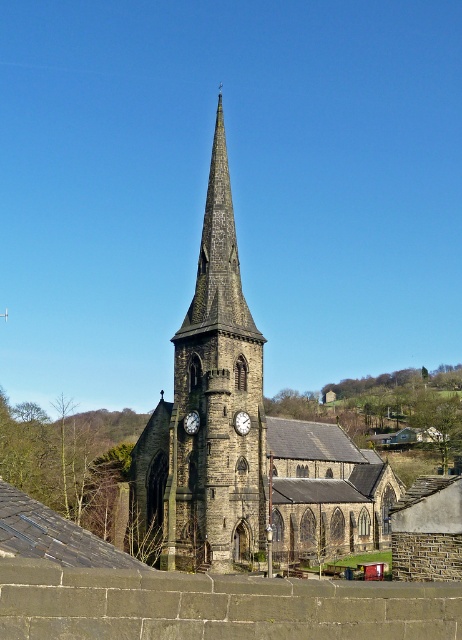
Can you confirm if dark stone church at center is positioned to the right of metallic clock at center?

Correct, you'll find dark stone church at center to the right of metallic clock at center.

Who is more distant from viewer, (302, 500) or (243, 413)?

Point (302, 500)

At what (x,y) coordinates should I click in order to perform the action: click on dark stone church at center. Please return your answer as a coordinate pair (x, y). Looking at the image, I should click on (245, 435).

Does metallic clock at center have a lesser width compared to white textured clock at center?

Yes.

Can you confirm if metallic clock at center is smaller than white textured clock at center?

Yes.

The height and width of the screenshot is (640, 462). I want to click on metallic clock at center, so click(x=242, y=422).

Does dark stone church at center appear on the right side of white textured clock at center?

Indeed, dark stone church at center is positioned on the right side of white textured clock at center.

Identify the location of dark stone church at center. The image size is (462, 640). (245, 435).